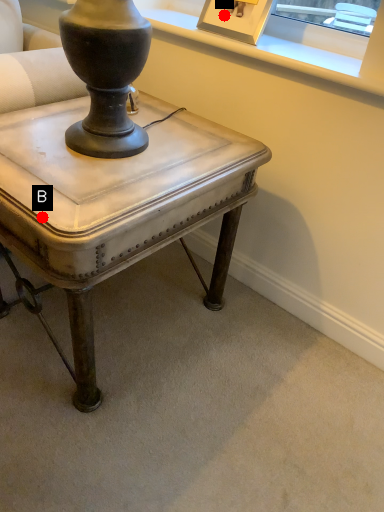
Question: Two points are circled on the image, labeled by A and B beside each circle. Which point is farther to the camera?

Choices:
 (A) A is further
 (B) B is further

Answer: (A)